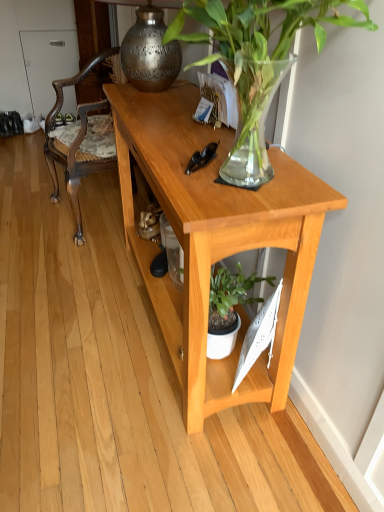
At what (x,y) coordinates should I click in order to perform the action: click on vacant point above light wood desk at center (from a real-world perspective). Please return your answer as a coordinate pair (x, y). Looking at the image, I should click on (177, 127).